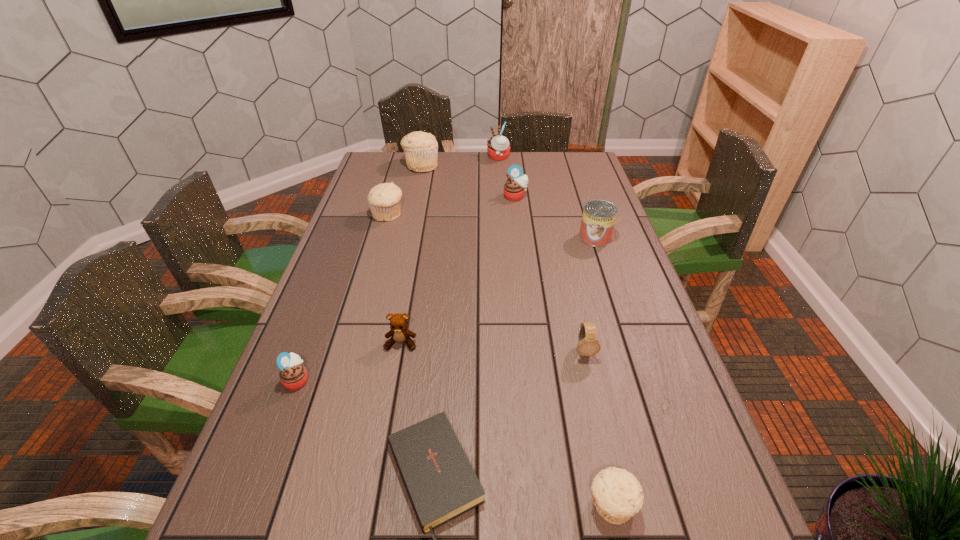
This screenshot has width=960, height=540. What are the coordinates of `muffin that stands as the fourth closest to the teddy bear` in the screenshot? It's located at click(x=516, y=185).

Image resolution: width=960 pixels, height=540 pixels. In order to click on muffin that is the second nearest to the watch in this screenshot , I will do `click(293, 375)`.

Identify the location of pink muffin that stands as the second closest to the watch. Image resolution: width=960 pixels, height=540 pixels. (516, 185).

Point out which pink muffin is positioned as the nearest to the farthest pink muffin. Please provide its 2D coordinates. Your answer should be formatted as a tuple, i.e. [(x, y)], where the tuple contains the x and y coordinates of a point satisfying the conditions above.

[(516, 185)]

Where is `beige muffin that stands as the third closest to the leftmost muffin`? This screenshot has height=540, width=960. beige muffin that stands as the third closest to the leftmost muffin is located at coordinates (x=421, y=149).

I want to click on beige muffin object that ranks as the second closest to the smallest beige muffin, so click(421, 149).

The height and width of the screenshot is (540, 960). Find the location of `vacant point that satisfies the following two spatial constraints: 1. on the front-facing side of the third farthest muffin; 2. on the left side of the nearest muffin`. vacant point that satisfies the following two spatial constraints: 1. on the front-facing side of the third farthest muffin; 2. on the left side of the nearest muffin is located at coordinates (551, 505).